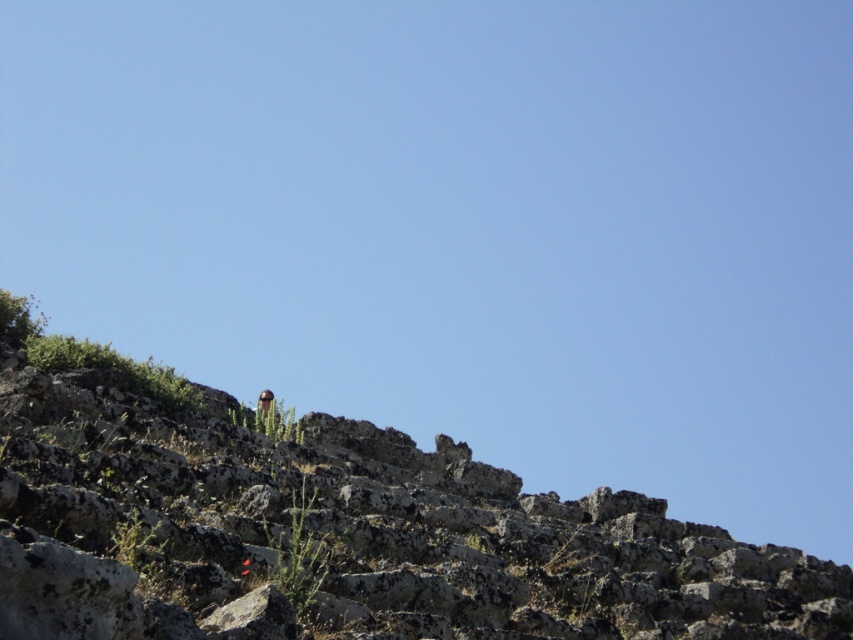
Between rough stone hillside at upper center and brown leather jacket at upper center, which one is positioned lower?

Positioned lower is brown leather jacket at upper center.

Who is more distant from viewer, (352,436) or (258,394)?

The point (258,394) is behind.

Find the location of a particular element. The image size is (853, 640). rough stone hillside at upper center is located at coordinates (334, 528).